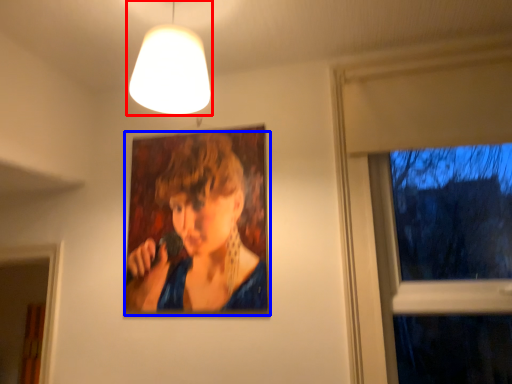
Question: Which point is further to the camera, lamp (highlighted by a red box) or person (highlighted by a blue box)?

Choices:
 (A) lamp
 (B) person

Answer: (B)